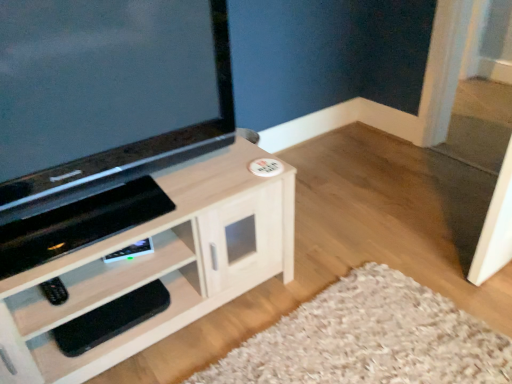
Describe the element at coordinates (54, 291) in the screenshot. Image resolution: width=512 pixels, height=384 pixels. I see `black matte remote at lower left` at that location.

What is the approximate height of black rubber footrest at lower left?

3.17 inches.

At what (x,y) coordinates should I click in order to perform the action: click on light wood cabinet at center. Please return your answer as a coordinate pair (x, y). Looking at the image, I should click on (158, 265).

What is the approximate height of matte black tv at upper left?

matte black tv at upper left is 21.72 inches tall.

The height and width of the screenshot is (384, 512). I want to click on black matte remote at lower left, so click(x=54, y=291).

Looking at this image, is black matte remote at lower left directly adjacent to light wood cabinet at center?

No, black matte remote at lower left is not next to light wood cabinet at center.

What's the angular difference between black matte remote at lower left and light wood cabinet at center's facing directions?

They differ by 0.00595 degrees in their facing directions.

Identify the location of remote to the left of light wood cabinet at center. The width and height of the screenshot is (512, 384). (54, 291).

From a real-world perspective, is black matte remote at lower left positioned above or below light wood cabinet at center?

From a real-world perspective, black matte remote at lower left is physically above light wood cabinet at center.

Is matte black tv at upper left positioned far away from black rubber footrest at lower left?

matte black tv at upper left is near black rubber footrest at lower left, not far away.

Between matte black tv at upper left and black rubber footrest at lower left, which one appears on the right side from the viewer's perspective?

matte black tv at upper left.

Can you confirm if black rubber footrest at lower left is bigger than light wood cabinet at center?

No, black rubber footrest at lower left is not bigger than light wood cabinet at center.

Is light wood cabinet at center inside black rubber footrest at lower left?

No, light wood cabinet at center is not surrounded by black rubber footrest at lower left.

Are black rubber footrest at lower left and light wood cabinet at center making contact?

No.

Can you tell me how much black rubber footrest at lower left and light wood cabinet at center differ in facing direction?

The angle between the facing direction of black rubber footrest at lower left and the facing direction of light wood cabinet at center is 0.00142 degrees.

Does matte black tv at upper left have a greater height compared to black matte remote at lower left?

Yes, matte black tv at upper left is taller than black matte remote at lower left.

In order to click on remote on the left side of matte black tv at upper left in this screenshot , I will do `click(54, 291)`.

Considering the sizes of objects matte black tv at upper left and black matte remote at lower left in the image provided, who is wider, matte black tv at upper left or black matte remote at lower left?

With larger width is matte black tv at upper left.

Is matte black tv at upper left in front of or behind black matte remote at lower left in the image?

matte black tv at upper left is positioned closer to the viewer than black matte remote at lower left.

Is black matte remote at lower left looking in the opposite direction of black rubber footrest at lower left?

black matte remote at lower left does not have its back to black rubber footrest at lower left.

From a real-world perspective, which is physically below, black matte remote at lower left or black rubber footrest at lower left?

In real-world perspective, black rubber footrest at lower left is lower.

Can you confirm if black matte remote at lower left is bigger than black rubber footrest at lower left?

Actually, black matte remote at lower left might be smaller than black rubber footrest at lower left.

Does point (182, 157) come behind point (164, 225)?

Yes, it is behind point (164, 225).

Looking at this image, is matte black tv at upper left positioned in front of light wood cabinet at center?

Yes.

Between matte black tv at upper left and light wood cabinet at center, which one has larger size?

Bigger between the two is light wood cabinet at center.

Considering the relative positions of matte black tv at upper left and light wood cabinet at center in the image provided, is matte black tv at upper left to the left of light wood cabinet at center from the viewer's perspective?

In fact, matte black tv at upper left is to the right of light wood cabinet at center.

Who is shorter, light wood cabinet at center or black matte remote at lower left?

black matte remote at lower left.

Is point (92, 308) closer to viewer compared to point (59, 297)?

No, it is not.

Are light wood cabinet at center and black matte remote at lower left located far from each other?

No.

Consider the image. Is black matte remote at lower left located within light wood cabinet at center?

Yes, light wood cabinet at center is surrounding black matte remote at lower left.

Where is `cabinetry on the right of black matte remote at lower left`? Image resolution: width=512 pixels, height=384 pixels. cabinetry on the right of black matte remote at lower left is located at coordinates (158, 265).

You are a GUI agent. You are given a task and a screenshot of the screen. Output one action in this format:
    pyautogui.click(x=<x>, y=<y>)
    Task: Click on the footrest behind the matte black tv at upper left
    
    Given the screenshot: What is the action you would take?
    pyautogui.click(x=111, y=319)

Based on their spatial positions, is black matte remote at lower left or light wood cabinet at center closer to black rubber footrest at lower left?

black matte remote at lower left.

From the image, which object appears to be farther from light wood cabinet at center, black matte remote at lower left or matte black tv at upper left?

Among the two, black matte remote at lower left is located further to light wood cabinet at center.

Looking at the image, which one is located closer to black matte remote at lower left, black rubber footrest at lower left or light wood cabinet at center?

Based on the image, black rubber footrest at lower left appears to be nearer to black matte remote at lower left.

Which object lies further to the anchor point black rubber footrest at lower left, matte black tv at upper left or light wood cabinet at center?

matte black tv at upper left is further to black rubber footrest at lower left.

Looking at the image, which one is located closer to matte black tv at upper left, light wood cabinet at center or black matte remote at lower left?

Based on the image, light wood cabinet at center appears to be nearer to matte black tv at upper left.

Considering their positions, is black rubber footrest at lower left positioned further to light wood cabinet at center than matte black tv at upper left?

matte black tv at upper left is further to light wood cabinet at center.

Considering their positions, is black matte remote at lower left positioned closer to black rubber footrest at lower left than matte black tv at upper left?

Among the two, black matte remote at lower left is located nearer to black rubber footrest at lower left.

Which object lies nearer to the anchor point black rubber footrest at lower left, light wood cabinet at center or matte black tv at upper left?

light wood cabinet at center.

Identify the location of cabinetry between matte black tv at upper left and black matte remote at lower left from top to bottom. This screenshot has width=512, height=384. (158, 265).

This screenshot has width=512, height=384. In order to click on remote between light wood cabinet at center and black rubber footrest at lower left from front to back in this screenshot , I will do `click(54, 291)`.

You are a GUI agent. You are given a task and a screenshot of the screen. Output one action in this format:
    pyautogui.click(x=<x>, y=<y>)
    Task: Click on the cabinetry between matte black tv at upper left and black rubber footrest at lower left in the vertical direction
    
    Given the screenshot: What is the action you would take?
    [x=158, y=265]

Image resolution: width=512 pixels, height=384 pixels. I want to click on remote between matte black tv at upper left and black rubber footrest at lower left in the up-down direction, so click(x=54, y=291).